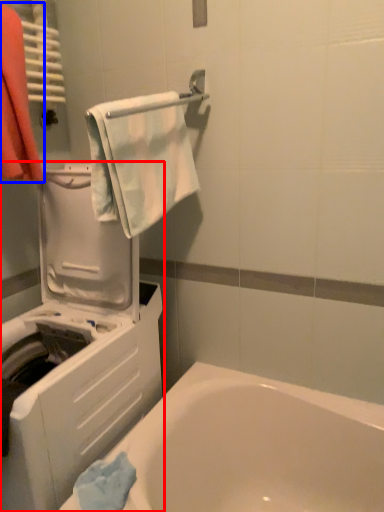
Question: Which object is further to the camera taking this photo, washing machine (highlighted by a red box) or laundry (highlighted by a blue box)?

Choices:
 (A) washing machine
 (B) laundry

Answer: (B)